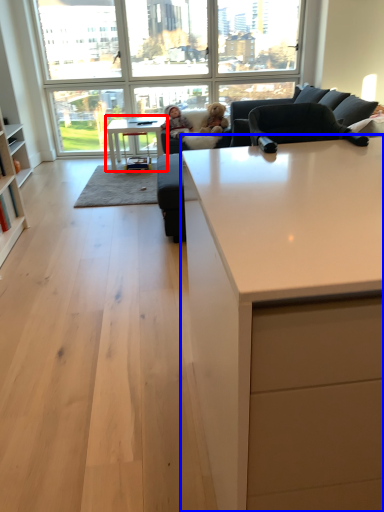
Question: Among these objects, which one is farthest to the camera, table (highlighted by a red box) or countertop (highlighted by a blue box)?

Choices:
 (A) table
 (B) countertop

Answer: (A)